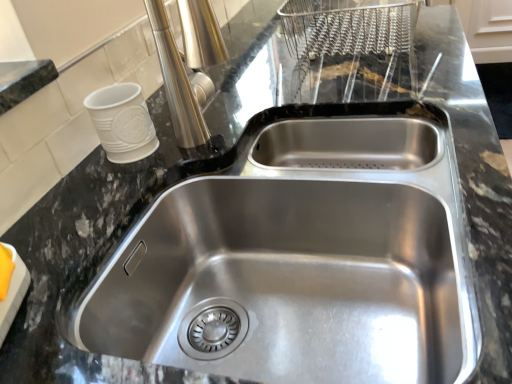
Describe the element at coordinates (287, 284) in the screenshot. The width and height of the screenshot is (512, 384). I see `stainless steel sink at center` at that location.

What is the approximate height of stainless steel sink at center?

stainless steel sink at center is 8.78 inches tall.

At what (x,y) coordinates should I click in order to perform the action: click on stainless steel sink at center. Please return your answer as a coordinate pair (x, y). The image size is (512, 384). Looking at the image, I should click on (287, 284).

This screenshot has width=512, height=384. Identify the location of stainless steel sink at center. (287, 284).